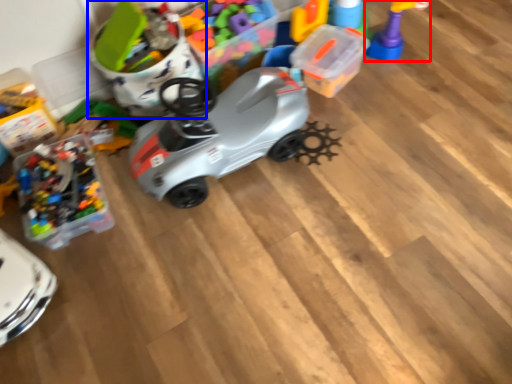
Question: Which object is closer to the camera taking this photo, toy (highlighted by a red box) or toy (highlighted by a blue box)?

Choices:
 (A) toy
 (B) toy

Answer: (B)